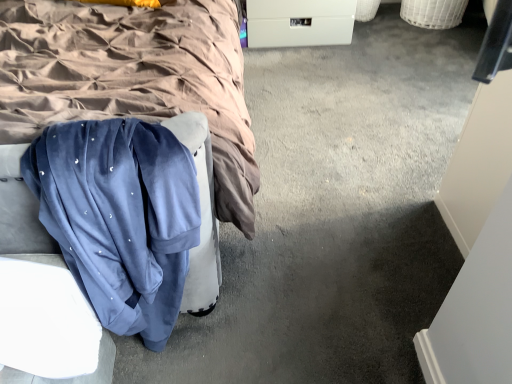
You are a GUI agent. You are given a task and a screenshot of the screen. Output one action in this format:
    pyautogui.click(x=<x>, y=<y>)
    Task: Click on the vacant space in front of white plastic drawer at center
    Image resolution: width=512 pixels, height=384 pixels.
    Given the screenshot: What is the action you would take?
    pyautogui.click(x=315, y=67)